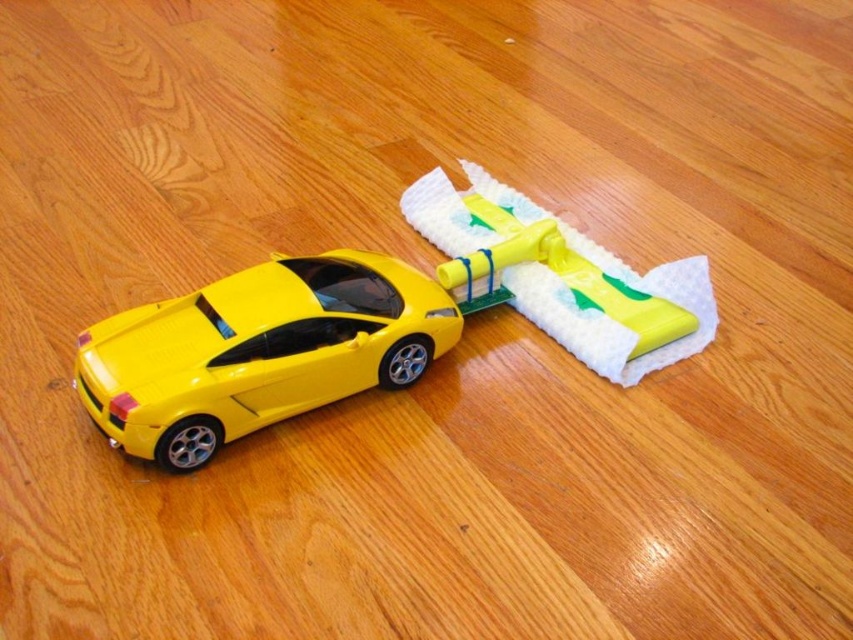
You are a child who wants to play with both cars. You are standing in front of the yellow glossy car at center. Which direction should you move to reach the yellow matte car at center?

The yellow matte car at center is to the right of the yellow glossy car at center, so you should move to your right to reach it.

You are a child who wants to play with the yellow matte car at center. Can you easily grab it without moving the yellow glossy car at center underneath?

The yellow matte car at center is positioned over the yellow glossy car at center, so you cannot easily grab the yellow matte car at center without moving the yellow glossy car at center underneath.